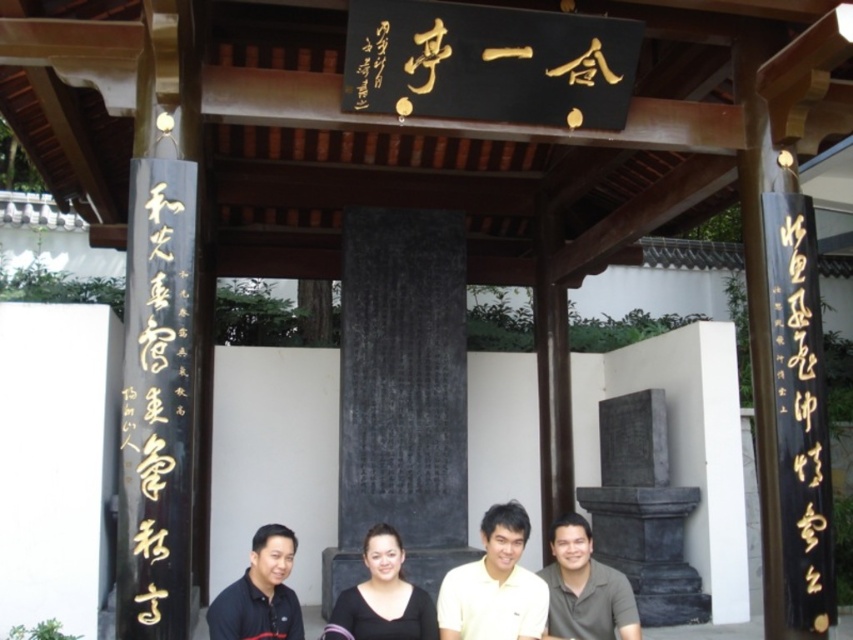
You are standing in front of a traditional East Asian pavilion with a signboard and banners. There is a black calligraphy at right located at point (799, 397). If you want to take a photo of the black calligraphy at right, where should you position yourself relative to the pavilion?

The black calligraphy at right is located at point (799, 397), so to take a photo of it, you should position yourself to the right side of the pavilion to capture the black calligraphy at right in your frame.

You are a photographer taking a group photo of the people in front of the pavilion. You want to arrange them so that the person in the black shirt at center is positioned to the right of the matte gray shirt at lower right. Is this possible based on their current positions?

The black shirt at center is currently to the left of the matte gray shirt at lower right, so to position the black shirt at center to the right of the matte gray shirt at lower right, they would need to swap places or move accordingly.